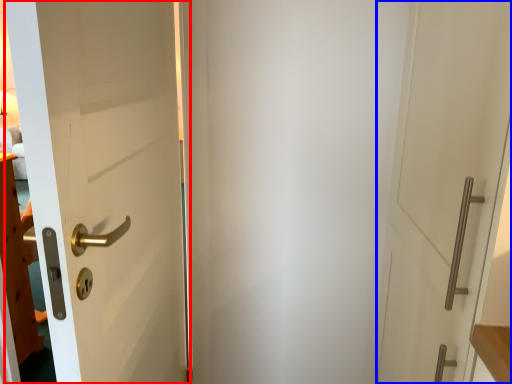
Question: Which of the following is the farthest to the observer, door (highlighted by a red box) or door (highlighted by a blue box)?

Choices:
 (A) door
 (B) door

Answer: (A)